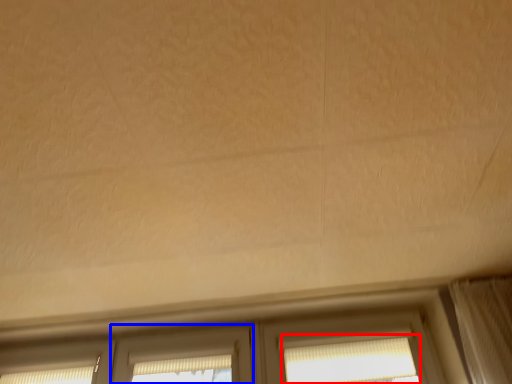
Question: Which object appears closest to the camera in this image, window (highlighted by a red box) or screen door (highlighted by a blue box)?

Choices:
 (A) window
 (B) screen door

Answer: (A)